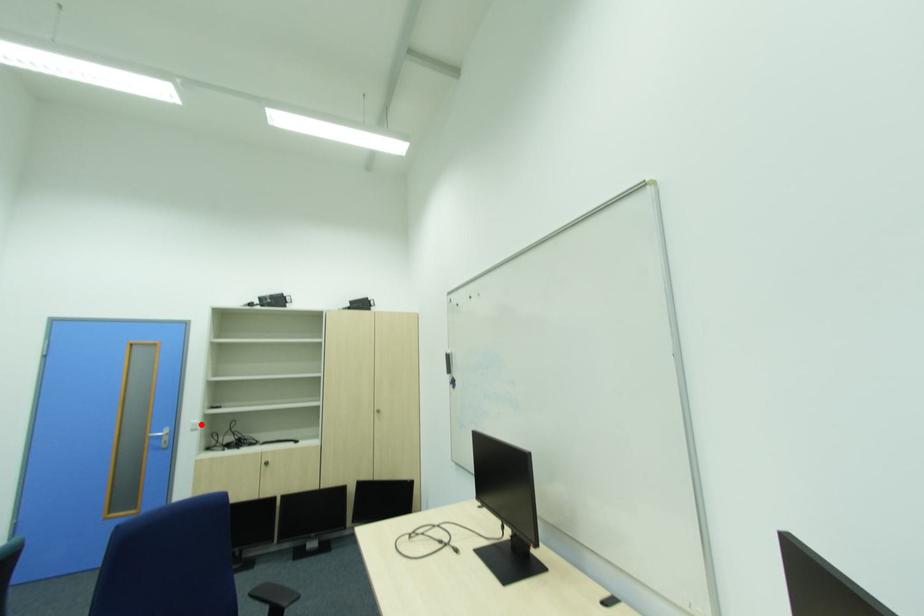
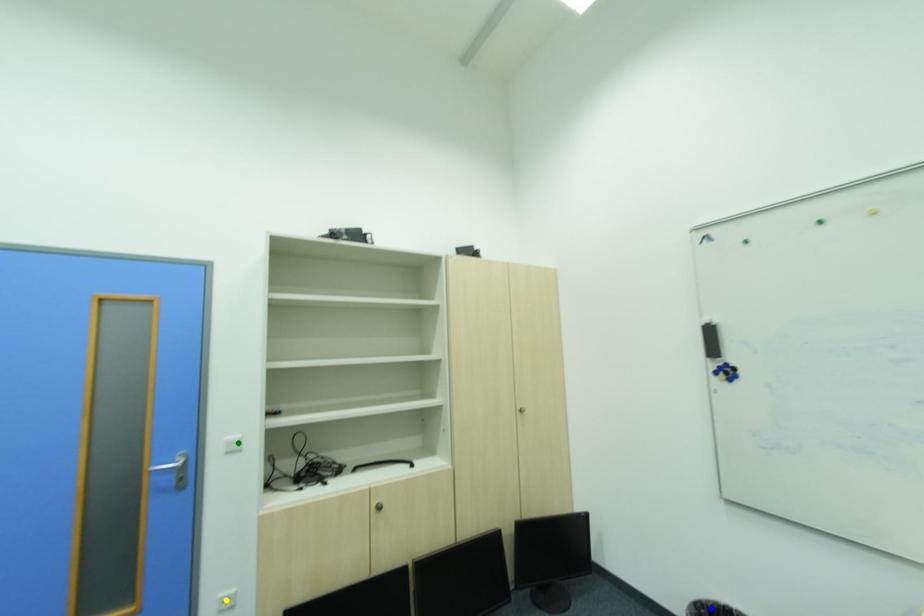
Question: I am providing you with two images of the same scene from different viewpoints. A red point is marked on the first image. You are given multiple points on the second image. Can you choose the point in image 2 that corresponds to the point in image 1?

Choices:
 (A) yellow point
 (B) blue point
 (C) green point

Answer: (C)